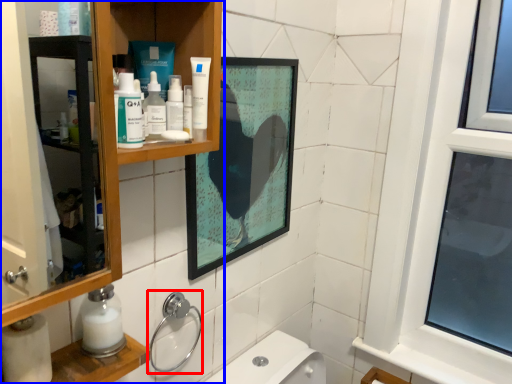
Question: Among these objects, which one is farthest to the camera, plumbing fixture (highlighted by a red box) or bathroom cabinet (highlighted by a blue box)?

Choices:
 (A) plumbing fixture
 (B) bathroom cabinet

Answer: (A)